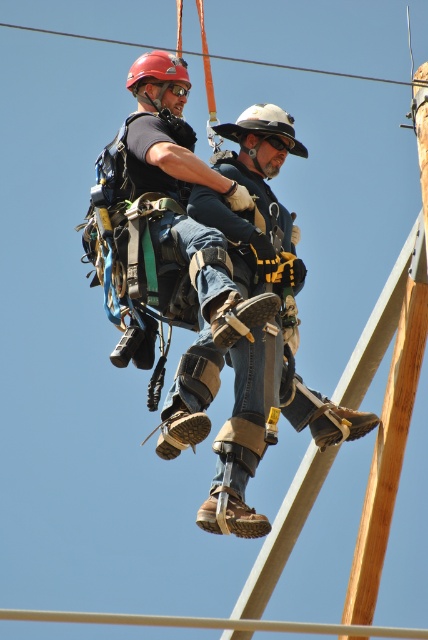
Can you confirm if white matte helmet at center is positioned below matte red helmet at upper left?

Correct, white matte helmet at center is located below matte red helmet at upper left.

Can you confirm if white matte helmet at center is positioned to the left of matte red helmet at upper left?

Incorrect, white matte helmet at center is not on the left side of matte red helmet at upper left.

Locate an element on the screen. The width and height of the screenshot is (428, 640). white matte helmet at center is located at coordinates (262, 125).

Is orange rope at upper center thinner than matte red helmet at upper left?

No, orange rope at upper center is not thinner than matte red helmet at upper left.

Looking at this image, measure the distance between orange rope at upper center and matte red helmet at upper left.

orange rope at upper center is 18.54 feet away from matte red helmet at upper left.

Does point (208, 54) come behind point (165, 65)?

Yes, it is behind point (165, 65).

Where is `orange rope at upper center`? orange rope at upper center is located at coordinates tap(312, 68).

Can you confirm if matte black prosthetic leg at center is taller than matte red helmet at upper left?

Yes.

Is matte black prosthetic leg at center to the right of matte red helmet at upper left from the viewer's perspective?

Yes, matte black prosthetic leg at center is to the right of matte red helmet at upper left.

Locate an element on the screen. matte black prosthetic leg at center is located at coordinates (267, 432).

Locate an element on the screen. matte black prosthetic leg at center is located at coordinates (267, 432).